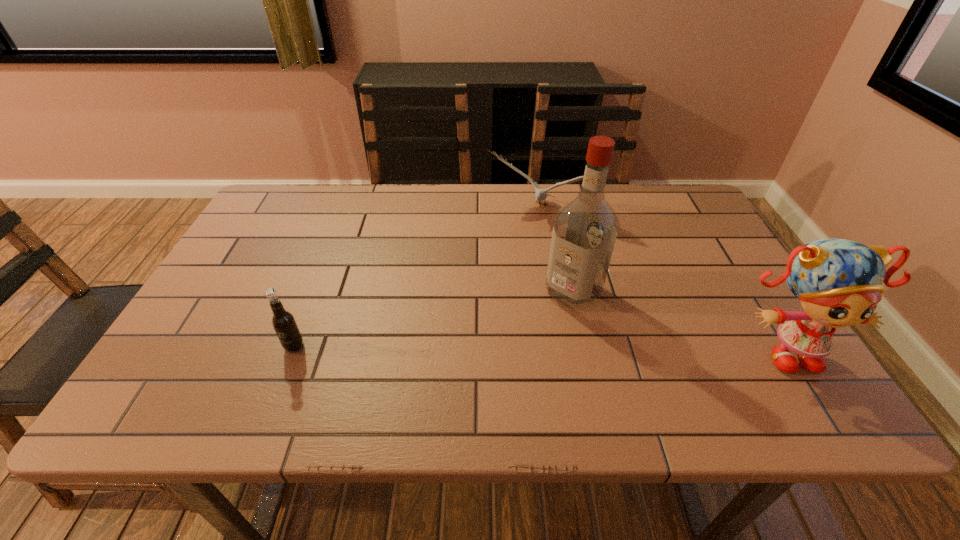
Identify the location of free region located on the front-facing side of the liquor. This screenshot has height=540, width=960. (504, 363).

Find the location of a particular element. The width and height of the screenshot is (960, 540). vacant region located 0.240m on the front-facing side of the liquor is located at coordinates (495, 373).

Find the location of a particular element. This screenshot has width=960, height=540. vacant space located 0.100m on the front-facing side of the liquor is located at coordinates pyautogui.click(x=534, y=332).

Where is `object situated at the far edge`? The image size is (960, 540). object situated at the far edge is located at coordinates (540, 194).

The height and width of the screenshot is (540, 960). I want to click on root beer positioned at the near edge, so click(283, 322).

The width and height of the screenshot is (960, 540). Identify the location of doll positioned at the near edge. (838, 281).

The image size is (960, 540). In order to click on object at the right edge in this screenshot , I will do `click(838, 281)`.

At what (x,y) coordinates should I click in order to perform the action: click on object located at the near right corner. Please return your answer as a coordinate pair (x, y). Looking at the image, I should click on (838, 281).

Where is `free space at the far edge of the desktop`? This screenshot has width=960, height=540. free space at the far edge of the desktop is located at coordinates (421, 193).

This screenshot has width=960, height=540. Identify the location of vacant space at the near edge of the desktop. (493, 357).